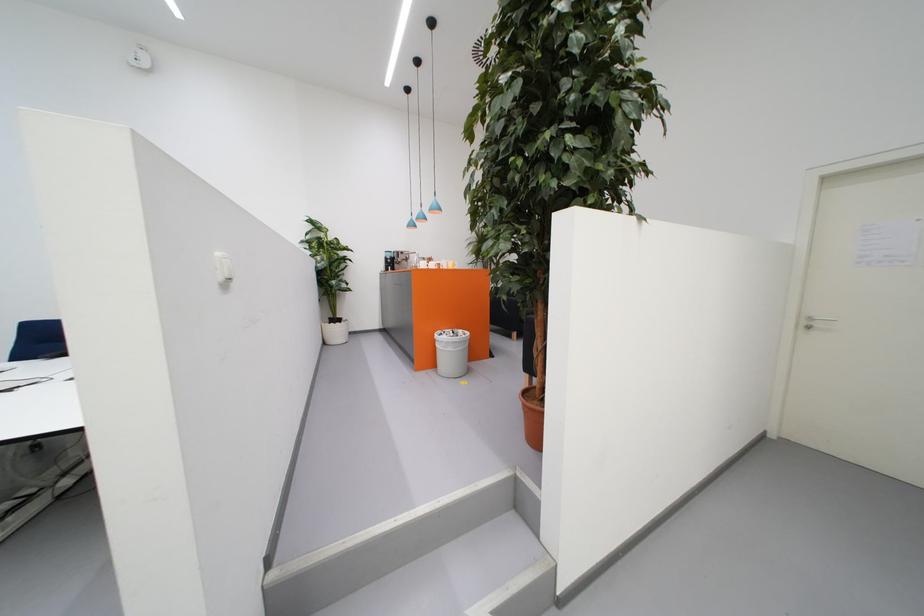
Where is `white light switch`? This screenshot has width=924, height=616. white light switch is located at coordinates (224, 268).